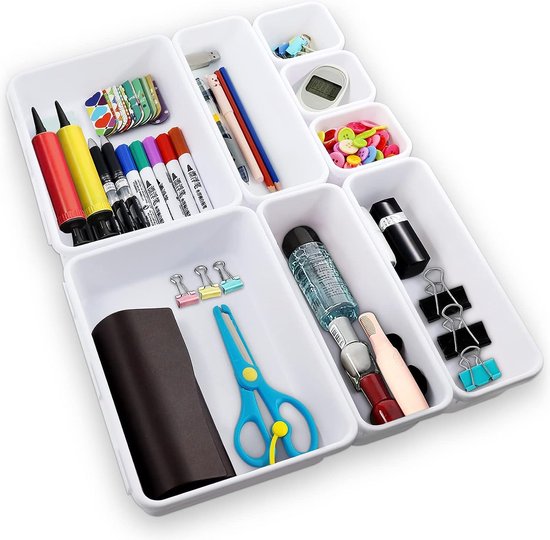
This screenshot has width=550, height=540. In order to click on markers in this screenshot , I will do `click(181, 140)`, `click(167, 148)`, `click(155, 156)`, `click(138, 152)`, `click(125, 156)`.